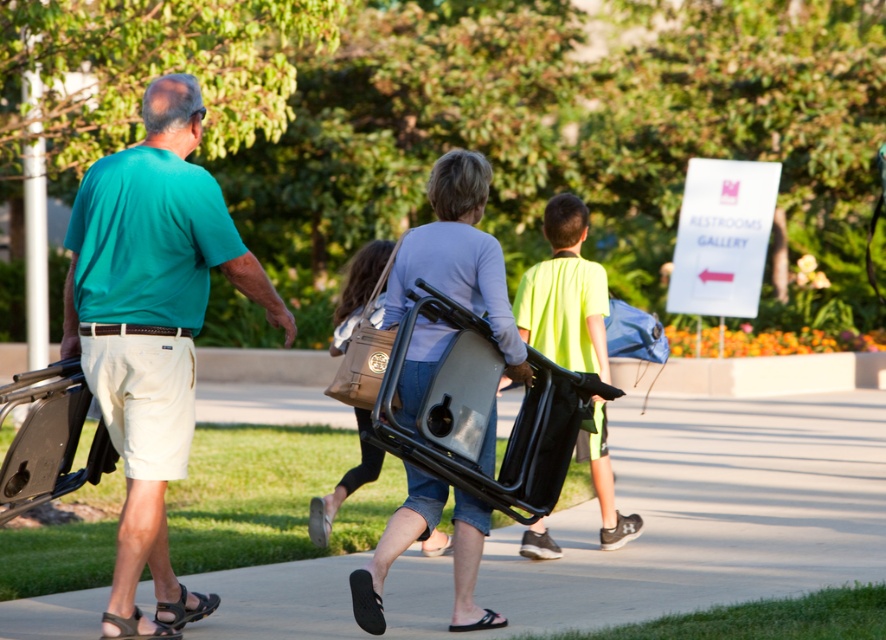
Between matte black cart at center and brown leather bag at center, which one has less height?

brown leather bag at center

Identify the location of matte black cart at center. The height and width of the screenshot is (640, 886). (459, 186).

Does black rubber pavement at center appear over brown leather bag at center?

Incorrect, black rubber pavement at center is not positioned above brown leather bag at center.

Is point (340, 561) positioned after point (338, 493)?

No, it is not.

At what (x,y) coordinates should I click in order to perform the action: click on black rubber pavement at center. Please return your answer as a coordinate pair (x, y). The width and height of the screenshot is (886, 640). Looking at the image, I should click on (709, 513).

Who is shorter, black rubber pavement at center or matte black cart at center?

With less height is black rubber pavement at center.

Is black rubber pavement at center below matte black cart at center?

Correct, black rubber pavement at center is located below matte black cart at center.

You are a GUI agent. You are given a task and a screenshot of the screen. Output one action in this format:
    pyautogui.click(x=<x>, y=<y>)
    Task: Click on the black rubber pavement at center
    
    Given the screenshot: What is the action you would take?
    pyautogui.click(x=709, y=513)

Identify the location of black rubber pavement at center. (709, 513).